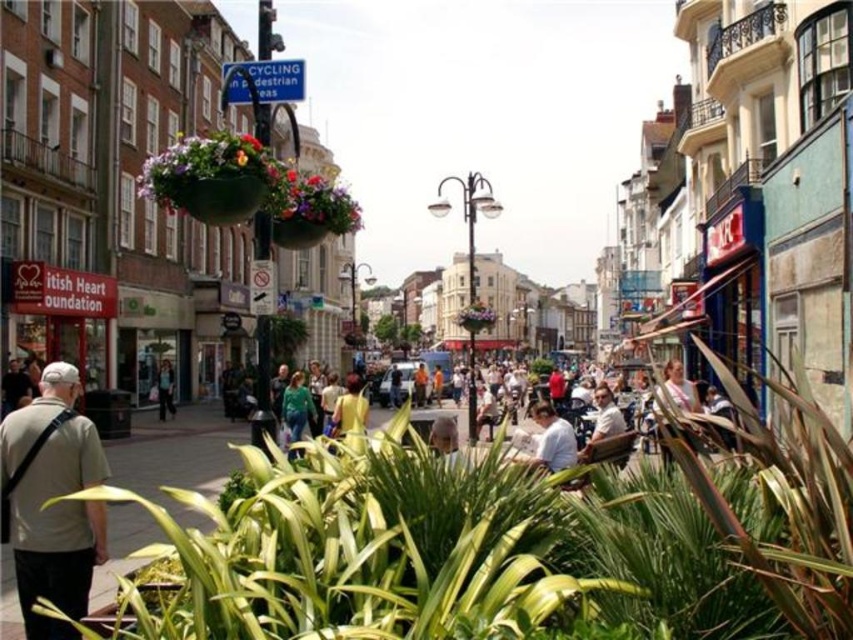
What are the coordinates of the floral hanging basket at center?

The floral hanging basket at center is located at coordinates point [309,209].

From the picture: You are a window cleaner standing on the sidewalk looking up at the street scene. You see the floral hanging basket at center and the yellow fabric at center. Which object is positioned higher from the ground?

The floral hanging basket at center is located above the yellow fabric at center, so it is positioned higher from the ground.